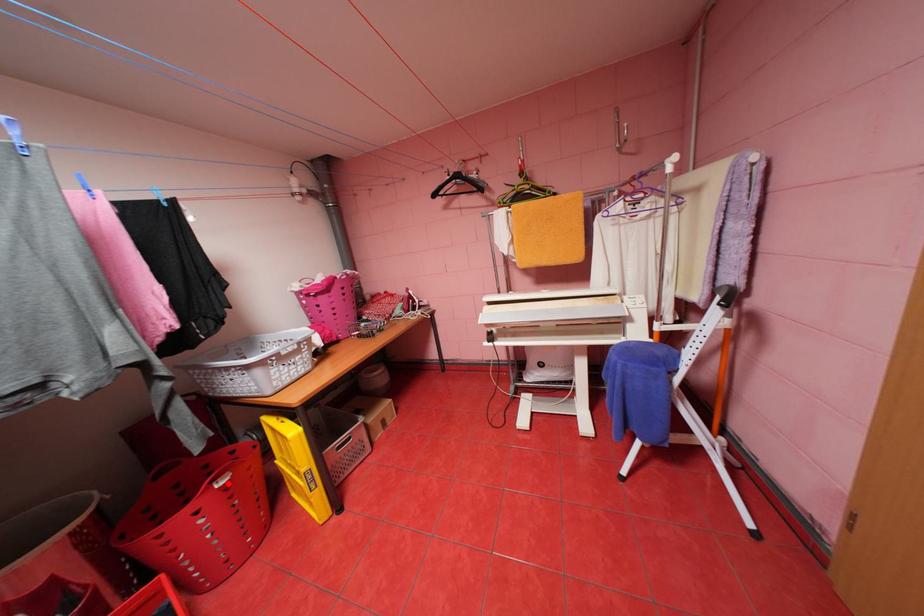
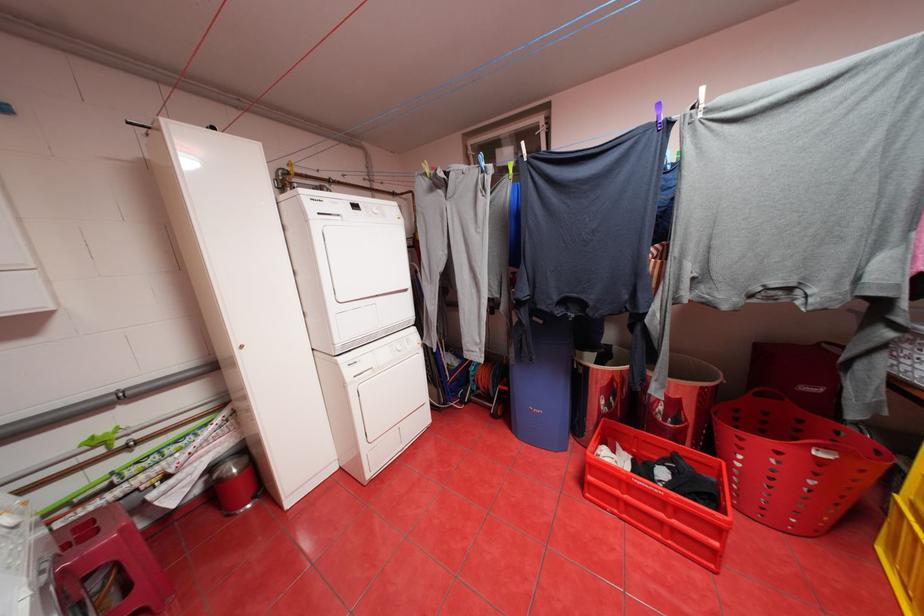
Question: I am providing you with two images of the same scene from different viewpoints. A red point is shown in image1. For the corresponding object point in image2, is it positioned nearer or farther from the camera?

Choices:
 (A) Nearer
 (B) Farther

Answer: (A)